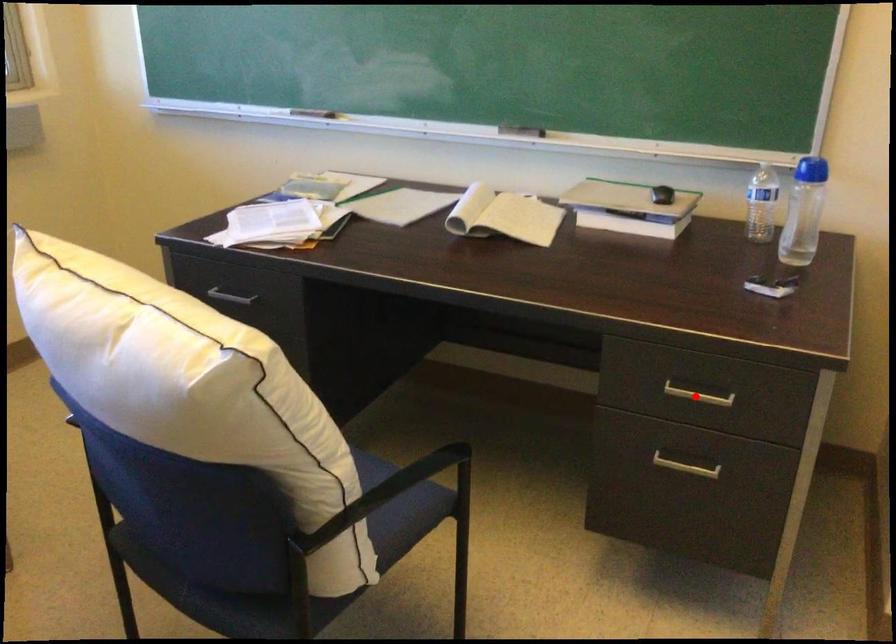
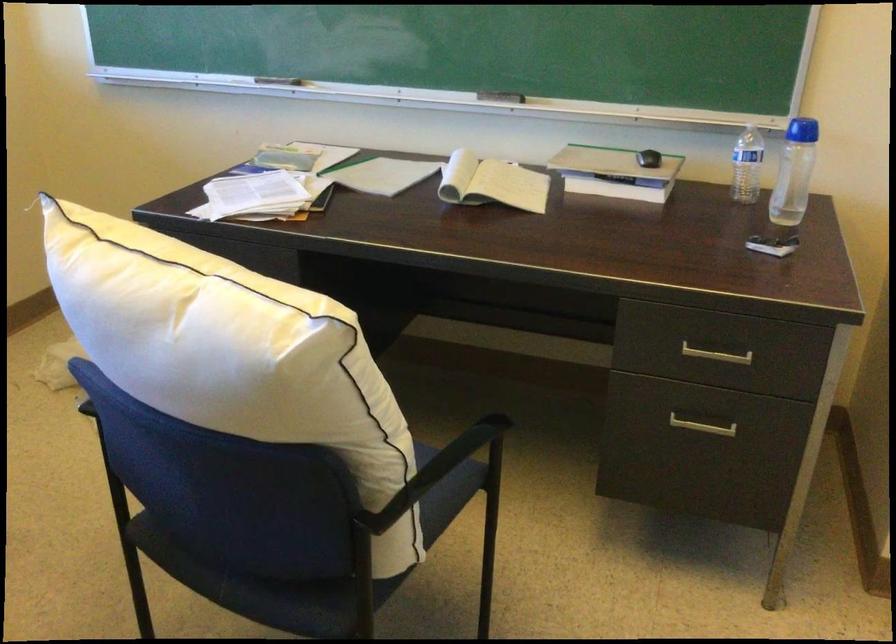
The point at the highlighted location is marked in the first image. Where is the corresponding point in the second image?

(716, 355)